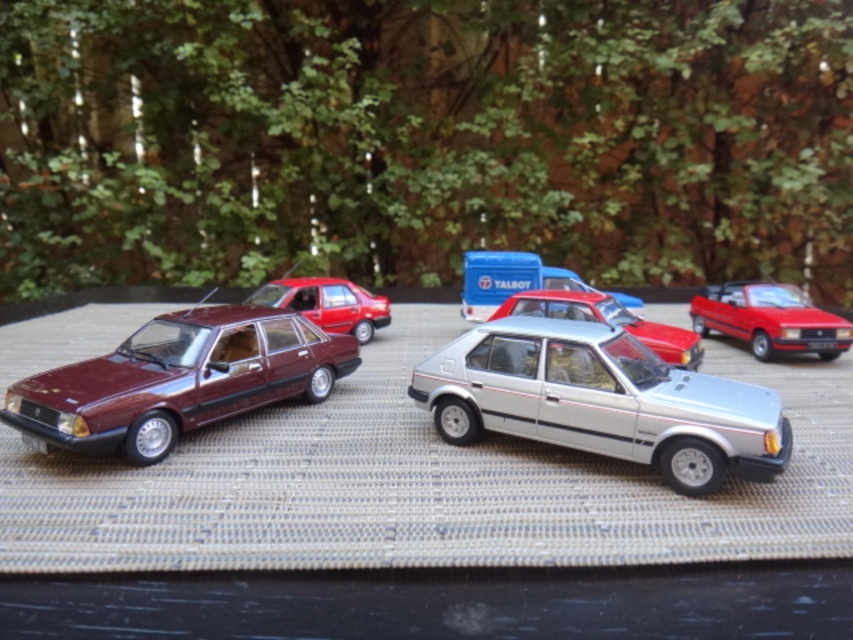
Is maroon metallic sedan at left to the left of satin silver sedan at center from the viewer's perspective?

Yes, maroon metallic sedan at left is to the left of satin silver sedan at center.

Between point (165, 451) and point (606, 323), which one is positioned in front?

Point (165, 451)

You are a GUI agent. You are given a task and a screenshot of the screen. Output one action in this format:
    pyautogui.click(x=<x>, y=<y>)
    Task: Click on the maroon metallic sedan at left
    The width and height of the screenshot is (853, 640).
    Given the screenshot: What is the action you would take?
    pyautogui.click(x=178, y=380)

Can you confirm if silver metallic hatchback at center is wider than maroon metallic sedan at left?

Yes.

Is silver metallic hatchback at center in front of maroon metallic sedan at left?

Yes, silver metallic hatchback at center is closer to the viewer.

Does point (547, 332) come in front of point (277, 310)?

Yes.

You are a GUI agent. You are given a task and a screenshot of the screen. Output one action in this format:
    pyautogui.click(x=<x>, y=<y>)
    Task: Click on the silver metallic hatchback at center
    Image resolution: width=853 pixels, height=640 pixels.
    Given the screenshot: What is the action you would take?
    tap(601, 401)

Between point (708, 301) and point (579, 298), which one is positioned behind?

The point (708, 301) is more distant.

Is point (846, 324) behind point (584, 308)?

No.

You are a GUI agent. You are given a task and a screenshot of the screen. Output one action in this format:
    pyautogui.click(x=<x>, y=<y>)
    Task: Click on the shiny red car at center
    The image size is (853, 640).
    Given the screenshot: What is the action you would take?
    point(769,320)